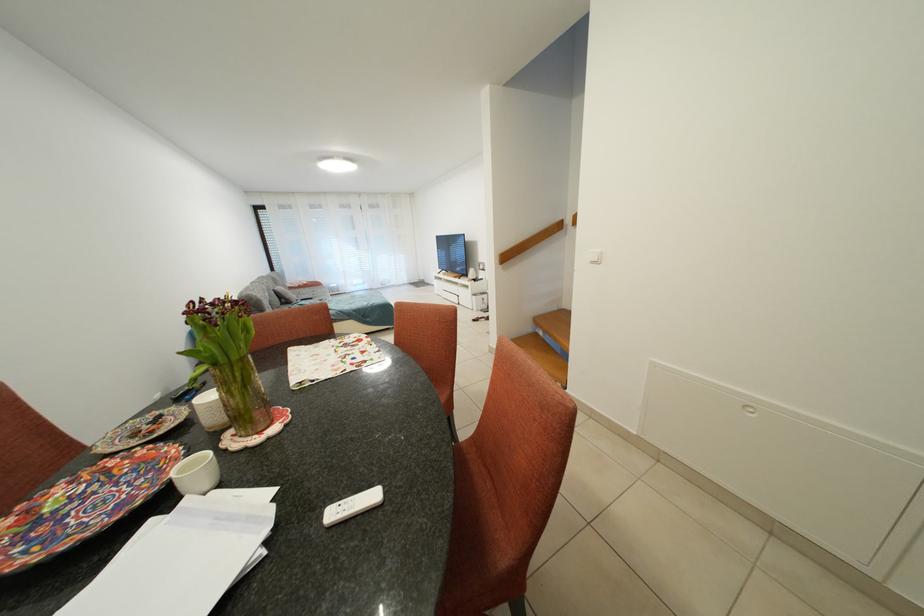
The width and height of the screenshot is (924, 616). What do you see at coordinates (196, 474) in the screenshot?
I see `the white ceramic cup` at bounding box center [196, 474].